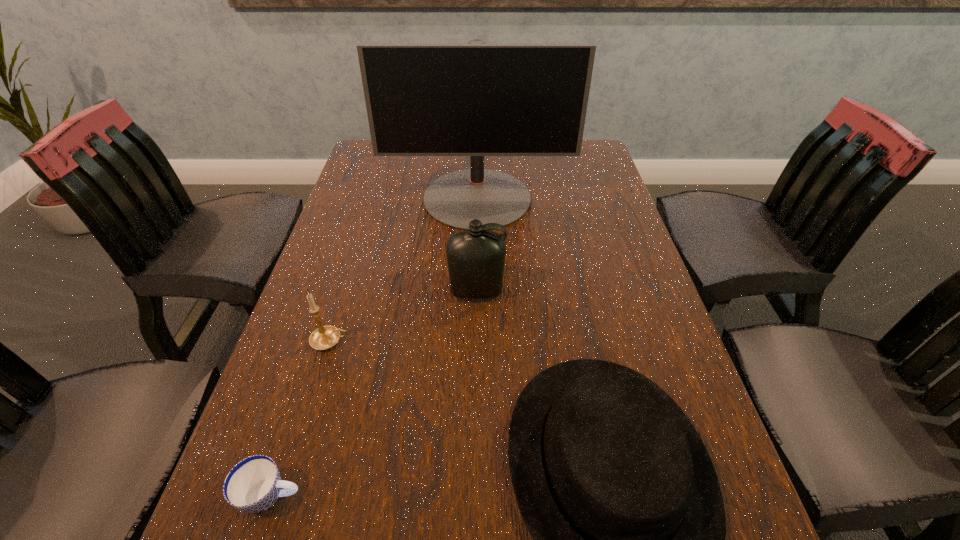
The width and height of the screenshot is (960, 540). Identify the location of vacant space situated 0.300m on the side of the cup with the handle. (498, 495).

I want to click on object located at the far edge, so click(476, 99).

The height and width of the screenshot is (540, 960). Identify the location of computer monitor situated at the left edge. (476, 99).

At what (x,y) coordinates should I click in order to perform the action: click on candle holder at the left edge. Please return your answer as a coordinate pair (x, y). Looking at the image, I should click on (325, 337).

Where is `cup at the left edge`? This screenshot has width=960, height=540. cup at the left edge is located at coordinates (253, 485).

This screenshot has height=540, width=960. What are the coordinates of `object that is at the right edge` in the screenshot? It's located at (476, 99).

Locate an element on the screen. object that is at the far left corner is located at coordinates (476, 99).

Where is `object at the far right corner`? The width and height of the screenshot is (960, 540). object at the far right corner is located at coordinates (476, 99).

Locate an element on the screen. The width and height of the screenshot is (960, 540). free space at the far edge of the desktop is located at coordinates (516, 156).

In order to click on vacant region at the left edge of the desktop in this screenshot , I will do `click(284, 424)`.